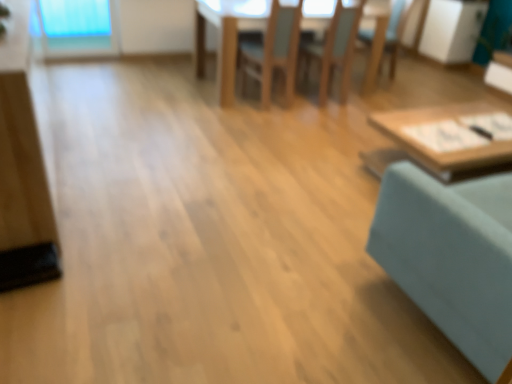
Question: Considering their positions, is wooden chair at center, positioned as the 3th chair in right-to-left order, located in front of or behind wooden chair at center, the 1th chair when ordered from right to left?

Choices:
 (A) behind
 (B) front

Answer: (B)

Question: Is point (293, 34) closer or farther from the camera than point (364, 31)?

Choices:
 (A) farther
 (B) closer

Answer: (B)

Question: Estimate the real-world distances between objects in this image. Which object is farther from the wooden chair at center, the third chair in the left-to-right sequence?

Choices:
 (A) wooden chair at center, which is the 1th chair from left to right
 (B) wooden chair at center, arranged as the second chair when viewed from the left
 (C) wooden table at center, the second table when ordered from front to back
 (D) wooden tray at right, the 2th table in the top-to-bottom sequence
 (E) teal fabric swivel chair at right

Answer: (E)

Question: Which is farther from the wooden table at center, which is counted as the first table, starting from the back?

Choices:
 (A) wooden chair at center, which is counted as the second chair, starting from the right
 (B) wooden chair at center, the 1th chair when ordered from right to left
 (C) wooden tray at right, the 2th table positioned from the back
 (D) wooden chair at center, positioned as the 3th chair in right-to-left order
 (E) matte wood dresser at left

Answer: (B)